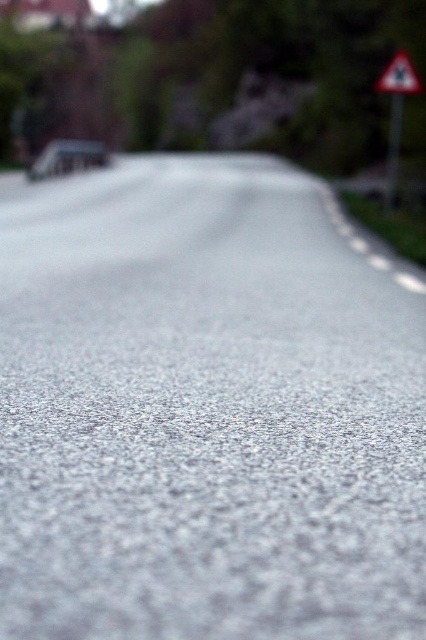
You are driving a car and see the white triangular sign at upper right and the white reflective triangle at upper right on the road. Which one is located to the right of the other?

The white triangular sign at upper right is positioned on the right side of the white reflective triangle at upper right.

You are standing on the road and see the white triangular sign at upper right. If you walk straight ahead, will the sign eventually disappear from your view due to the road curving to the right?

The road curves gently to the right, and the white triangular sign at upper right is 5.17 meters away. Since the road bends, walking straight might cause the sign to eventually disappear from view depending on the curve and distance, but the exact outcome isn